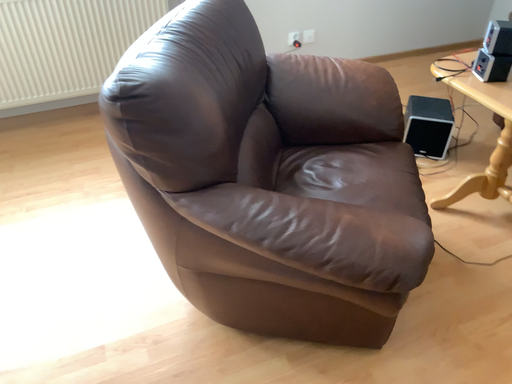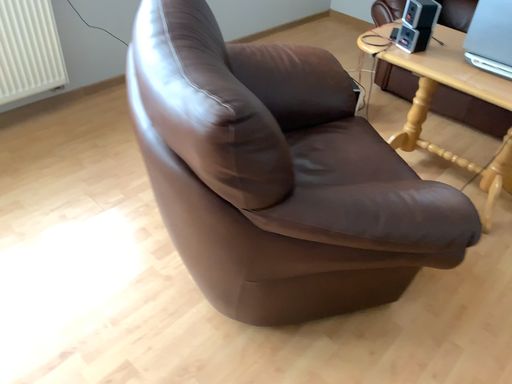
Question: Which way did the camera rotate in the video?

Choices:
 (A) rotated right
 (B) rotated left

Answer: (A)